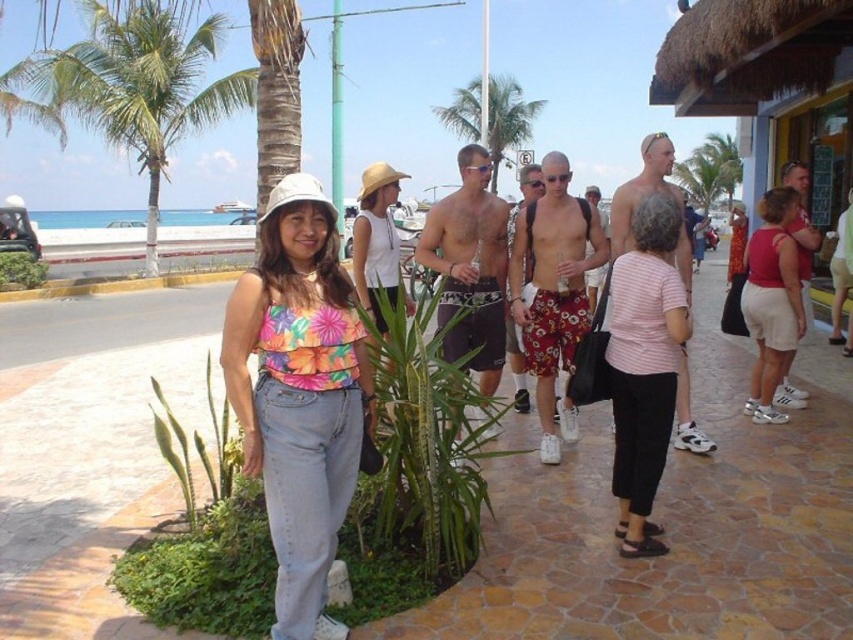
You are standing in the tropical beachside scene and want to place a small flag at each of the two points labeled point [614,234] and point [512,218]. Which point should you place the flag closer to the front of the image?

Point [614,234] is closer to the viewer than point [512,218], so you should place the flag at point [614,234] to have it closer to the front of the image.

You are a photographer trying to capture a photo of the matte pink tank top at center and the green leafy palm tree at upper left. If your camera has a maximum zoom range of 15 meters, can you fit both subjects into the frame without moving closer?

The distance between the green leafy palm tree at upper left and the matte pink tank top at center is 14.54 meters. Since the camera can zoom up to 15 meters, it is possible to capture both subjects in the frame without moving closer.

You are standing in a tropical beachside area and see the shiny silver watch at center. If you want to reach it without moving your feet, can you do it?

The shiny silver watch at center is 3.48 meters from viewer, so you cannot reach it without moving your feet since it is too far away.